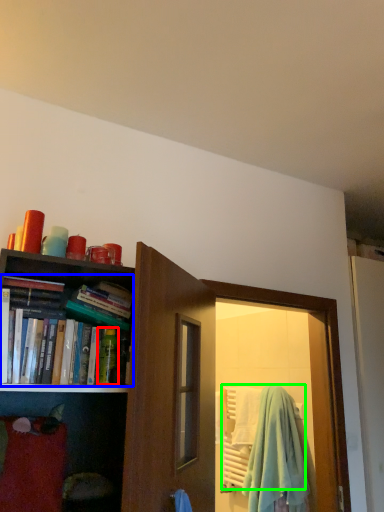
Question: Which object is positioned closest to toiletry (highlighted by a red box)? Select from book (highlighted by a blue box) and beach towel (highlighted by a green box).

Choices:
 (A) book
 (B) beach towel

Answer: (A)